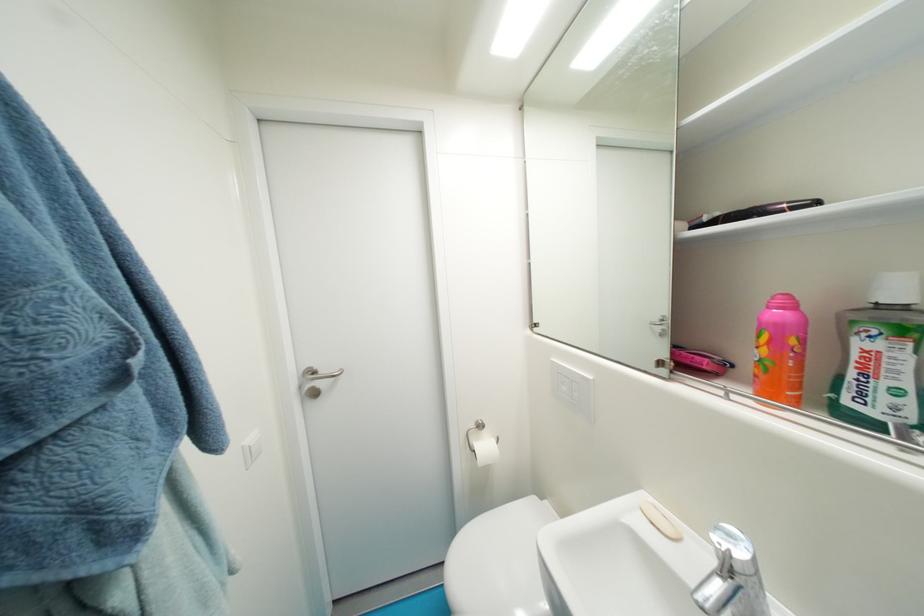
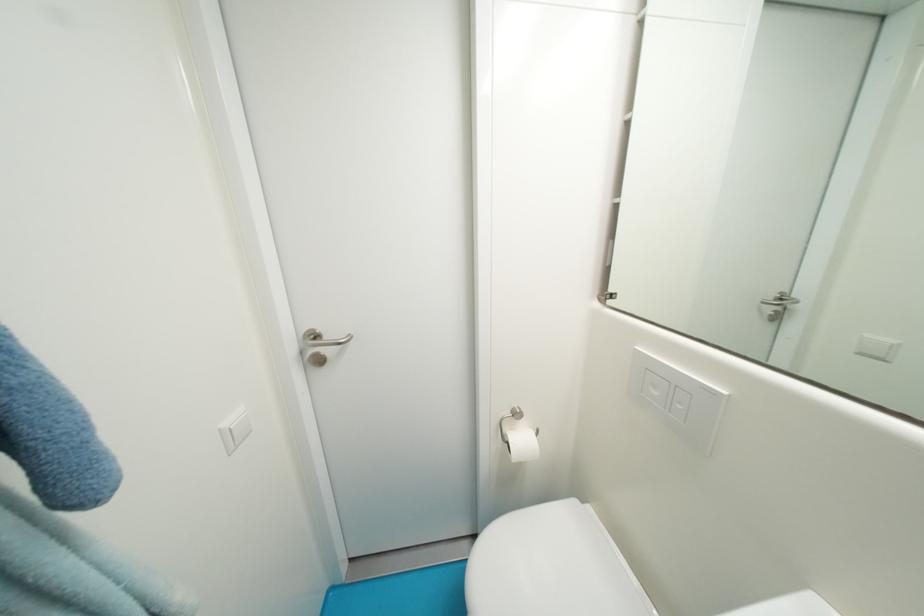
The point at (322,374) is marked in the first image. Where is the corresponding point in the second image?

(323, 339)